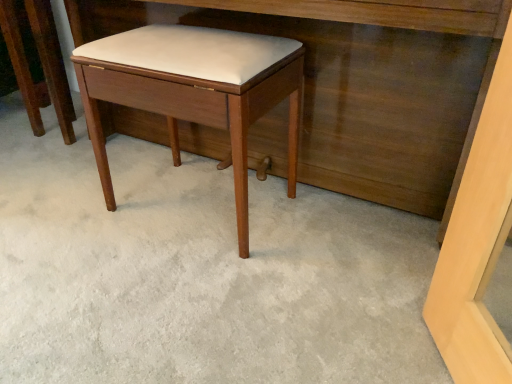
Question: In the image, is matte wood stool at center positioned in front of or behind matte wood vanity at center?

Choices:
 (A) behind
 (B) front

Answer: (A)

Question: Looking at their shapes, would you say matte wood stool at center is wider or thinner than matte wood vanity at center?

Choices:
 (A) thin
 (B) wide

Answer: (A)

Question: Based on their relative distances, which object is nearer to the matte wood stool at center?

Choices:
 (A) matte wood stool at center
 (B) matte wood vanity at center

Answer: (B)

Question: Which object is positioned farthest from the matte wood stool at center?

Choices:
 (A) matte wood vanity at center
 (B) matte wood stool at center

Answer: (B)